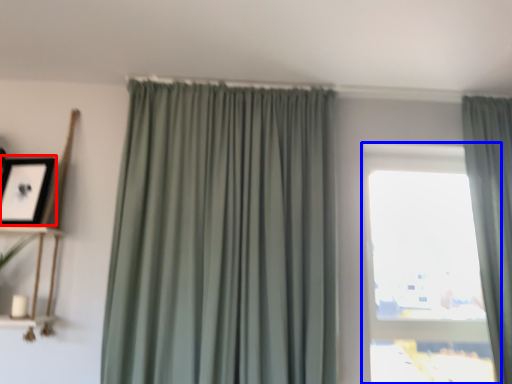
Question: Which object is closer to the camera taking this photo, picture frame (highlighted by a red box) or window (highlighted by a blue box)?

Choices:
 (A) picture frame
 (B) window

Answer: (A)